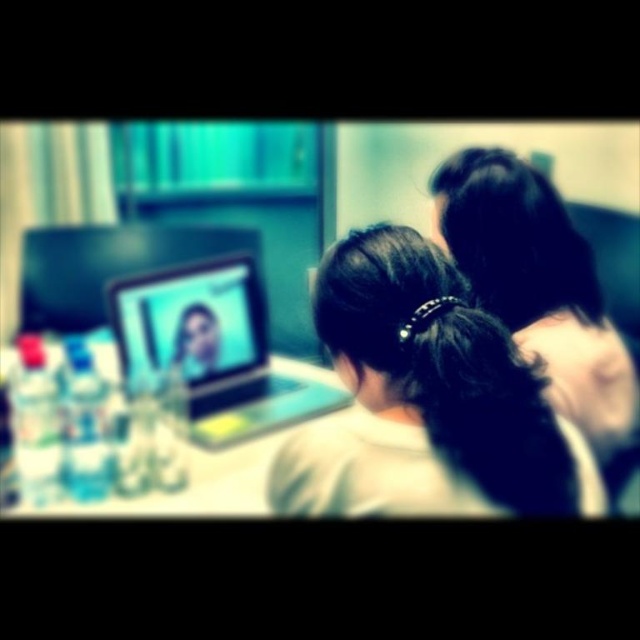
You are designing a poster for a tech conference and need to include both the dark brown hair at center and the teal glossy laptop at center. Since the laptop is part of the conference theme, you want to ensure it stands out. Based on their sizes, which object should you make larger in the poster?

The teal glossy laptop at center should be made larger in the poster since its width is greater than the dark brown hair at center.

You are trying to see the laptop screen clearly in the image. The dark brown hair at center and the teal glossy laptop at center are both in your line of sight. Which object is closer to you, blocking your view of the other?

The dark brown hair at center is in front of the teal glossy laptop at center, so the dark brown hair at center is closer and blocking the view of the teal glossy laptop at center.